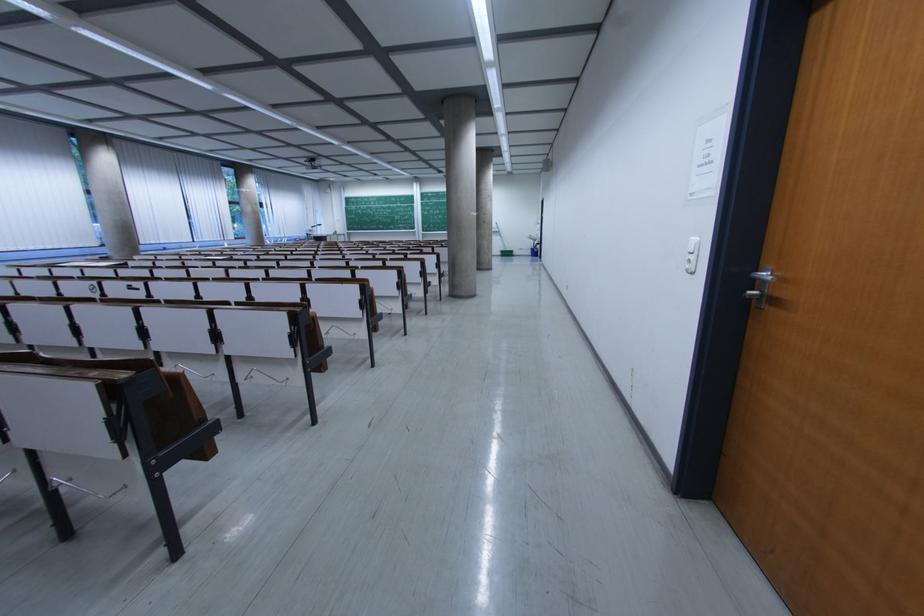
Where is `white light switch`? This screenshot has height=616, width=924. white light switch is located at coordinates (691, 254).